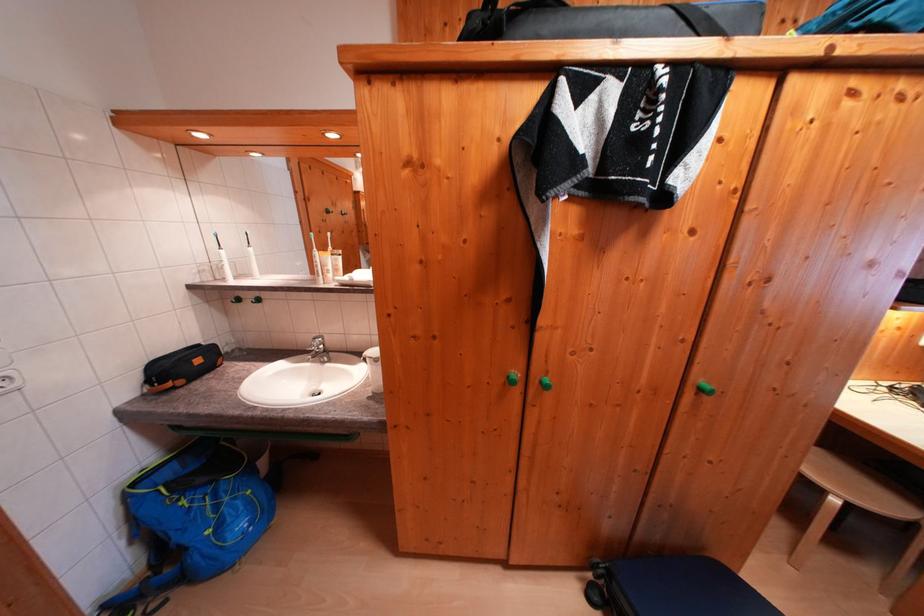
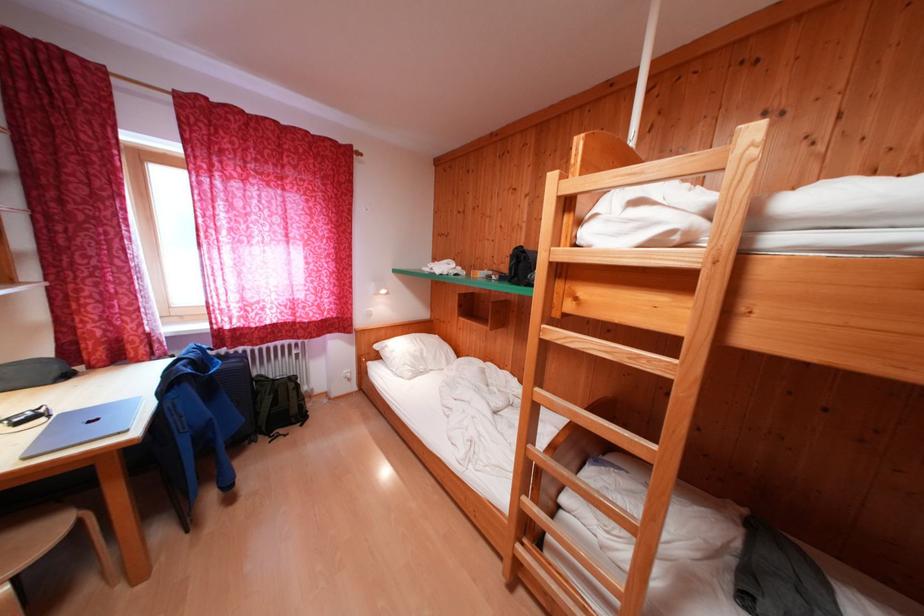
Find the pixel in the second image that matches (x=896, y=509) in the first image.

(55, 538)